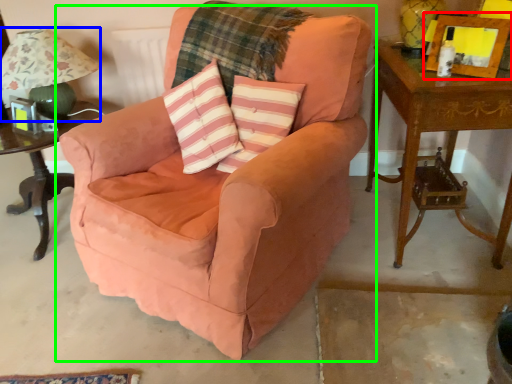
Question: Which is nearer to the picture frame (highlighted by a red box)? table lamp (highlighted by a blue box) or chair (highlighted by a green box).

Choices:
 (A) table lamp
 (B) chair

Answer: (B)